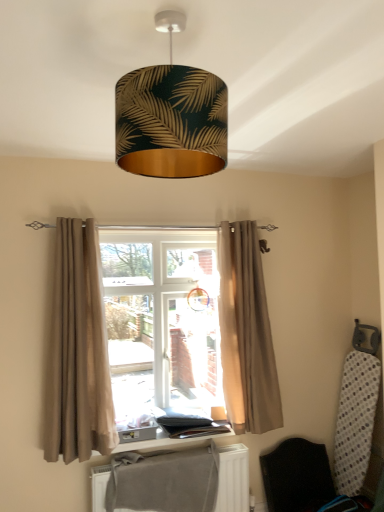
Question: Considering the positions of beige fabric curtain at center, which is the 1th curtain in right-to-left order, and gray fabric at lower center in the image, is beige fabric curtain at center, which is the 1th curtain in right-to-left order, wider or thinner than gray fabric at lower center?

Choices:
 (A) thin
 (B) wide

Answer: (B)

Question: From a real-world perspective, relative to gray fabric at lower center, is beige fabric curtain at center, which is the 1th curtain in right-to-left order, vertically above or below?

Choices:
 (A) above
 (B) below

Answer: (A)

Question: Based on their relative distances, which object is farther from the wooden window sill at center?

Choices:
 (A) gray fabric at lower center
 (B) beige fabric curtain at left, positioned as the second curtain in right-to-left order
 (C) beige fabric curtain at center
 (D) beige fabric curtain at center, which appears as the second curtain when viewed from the left
 (E) black fabric folding chair at lower right

Answer: (B)

Question: Which of these objects is positioned farthest from the gray fabric at lower center?

Choices:
 (A) black fabric folding chair at lower right
 (B) beige fabric curtain at center
 (C) beige fabric curtain at left, positioned as the second curtain in right-to-left order
 (D) wooden window sill at center
 (E) gold leaf-patterned lampshade at upper center

Answer: (E)